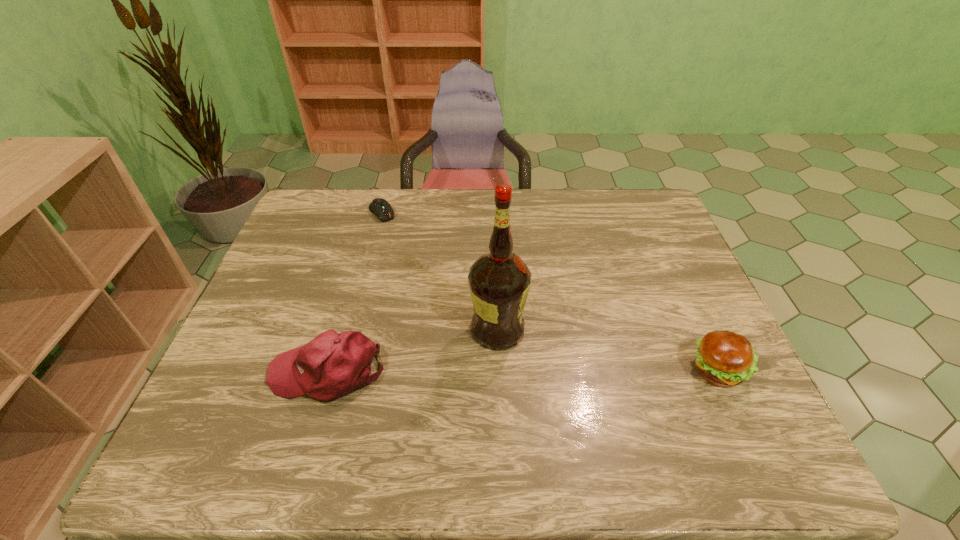
You are a GUI agent. You are given a task and a screenshot of the screen. Output one action in this format:
    pyautogui.click(x=<x>, y=<y>)
    Task: Click on the object present at the near right corner
    
    Given the screenshot: What is the action you would take?
    pyautogui.click(x=724, y=358)

This screenshot has width=960, height=540. Find the location of `vacant space at the far edge`. vacant space at the far edge is located at coordinates (512, 224).

Image resolution: width=960 pixels, height=540 pixels. In the image, there is a desktop. What are the coordinates of `free space at the near edge` in the screenshot? It's located at (396, 388).

Locate an element on the screen. The height and width of the screenshot is (540, 960). free location at the left edge of the desktop is located at coordinates (300, 234).

Locate an element on the screen. vacant space at the right edge is located at coordinates (672, 299).

Find the location of a particular element. The width and height of the screenshot is (960, 540). blank space at the far right corner of the desktop is located at coordinates (637, 188).

In the image, there is a desktop. Where is `vacant space at the near right corner`? vacant space at the near right corner is located at coordinates (739, 391).

Locate an element on the screen. free spot between the hamburger and the baseball cap is located at coordinates (523, 372).

Where is `free point between the baseball cap and the computer equipment`? The height and width of the screenshot is (540, 960). free point between the baseball cap and the computer equipment is located at coordinates (354, 293).

Find the location of a particular element. The height and width of the screenshot is (540, 960). empty space that is in between the farthest object and the baseball cap is located at coordinates (354, 293).